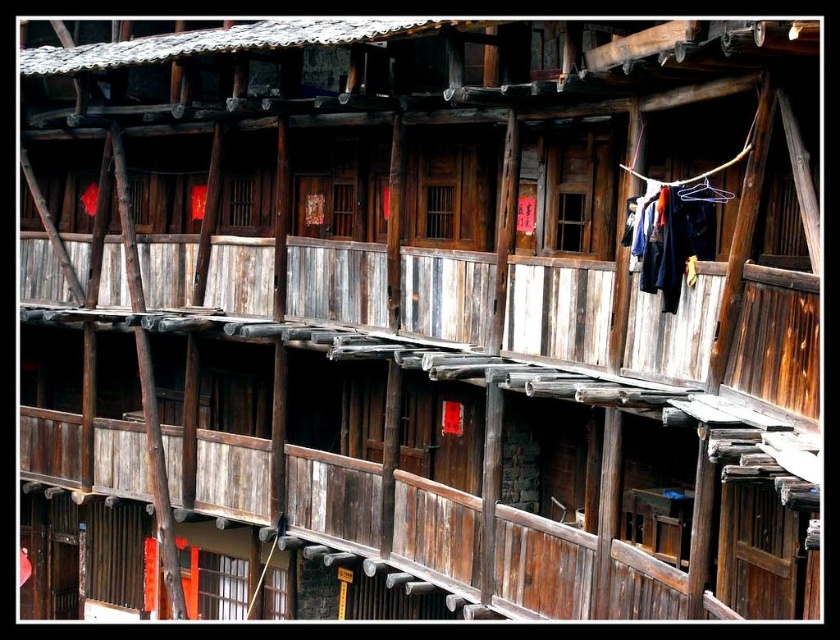
Question: Among these points, which one is farthest from the camera?

Choices:
 (A) (680, 289)
 (B) (680, 195)

Answer: (A)

Question: Which object is farther from the camera taking this photo?

Choices:
 (A) black fabric hanger at upper right
 (B) dark blue fabric at upper right

Answer: (B)

Question: Is dark blue fabric at upper right positioned at the back of black fabric hanger at upper right?

Choices:
 (A) yes
 (B) no

Answer: (A)

Question: Can you confirm if dark blue fabric at upper right is positioned above black fabric hanger at upper right?

Choices:
 (A) yes
 (B) no

Answer: (B)

Question: From the image, what is the correct spatial relationship of dark blue fabric at upper right in relation to black fabric hanger at upper right?

Choices:
 (A) left
 (B) right

Answer: (A)

Question: Which point is farther to the camera?

Choices:
 (A) click(x=686, y=193)
 (B) click(x=667, y=268)

Answer: (B)